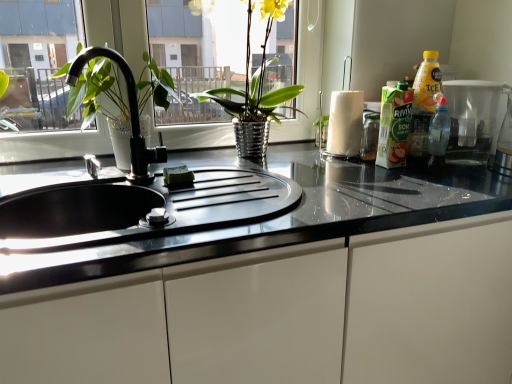
What do you see at coordinates (345, 123) in the screenshot?
I see `white glossy paper towel at center right` at bounding box center [345, 123].

Locate an element on the screen. This screenshot has width=512, height=384. white glossy paper towel at center right is located at coordinates 345,123.

Looking at this image, measure the distance between point (486, 141) and camera.

1.40 meters.

In order to face translucent plastic container at right, should I rotate leftwards or rightwards?

A 25.445 degree turn to the right will do.

Describe the element at coordinates (438, 136) in the screenshot. I see `transparent plastic bottle at right` at that location.

What do you see at coordinates (117, 95) in the screenshot? This screenshot has width=512, height=384. I see `black matte faucet at center` at bounding box center [117, 95].

What do you see at coordinates (255, 90) in the screenshot? I see `shiny metallic vase at center` at bounding box center [255, 90].

Find the location of a particular element. This screenshot has height=384, width=512. white glossy paper towel at center right is located at coordinates (345, 123).

From the image's perspective, is glossy white cabinet at center under black matte faucet at center?

Indeed, from the image's perspective, glossy white cabinet at center is shown beneath black matte faucet at center.

Is glossy white cabinet at center completely or partially outside of black matte faucet at center?

Yes.

How distant is glossy white cabinet at center from black matte faucet at center?

The distance of glossy white cabinet at center from black matte faucet at center is 64.97 centimeters.

Can you confirm if glossy white cabinet at center is positioned to the left of black matte faucet at center?

Incorrect, glossy white cabinet at center is not on the left side of black matte faucet at center.

Do you think transparent plastic bottle at right is within glossy white cabinet at center, or outside of it?

transparent plastic bottle at right is outside glossy white cabinet at center.

Between transparent plastic bottle at right and glossy white cabinet at center, which one has smaller size?

transparent plastic bottle at right.

Is transparent plastic bottle at right to the left of glossy white cabinet at center from the viewer's perspective?

In fact, transparent plastic bottle at right is to the right of glossy white cabinet at center.

Consider the image. Which is closer to the camera, [402,97] or [116,92]?

Point [402,97] appears to be closer to the viewer than point [116,92].

Is translucent plastic bottle at right smaller than black matte faucet at center?

Correct, translucent plastic bottle at right occupies less space than black matte faucet at center.

Is translucent plastic bottle at right completely or partially outside of black matte faucet at center?

Absolutely, translucent plastic bottle at right is external to black matte faucet at center.

In the scene shown: From the image's perspective, which object appears higher, translucent plastic bottle at right or black matte faucet at center?

black matte faucet at center, from the image's perspective.

Is translucent plastic bottle at right directly adjacent to shiny metallic vase at center?

translucent plastic bottle at right and shiny metallic vase at center are clearly separated.

Is translucent plastic bottle at right turned away from shiny metallic vase at center?

No.

Is translucent plastic bottle at right smaller than shiny metallic vase at center?

Correct, translucent plastic bottle at right occupies less space than shiny metallic vase at center.

Which is closer to the camera, (399, 90) or (245, 86)?

The point (399, 90) is closer to the camera.

Is point (393, 123) farther from camera compared to point (141, 317)?

Yes, point (393, 123) is behind point (141, 317).

Would you consider translucent plastic bottle at right to be distant from glossy white cabinet at center?

Actually, translucent plastic bottle at right and glossy white cabinet at center are a little close together.

Can you confirm if translucent plastic bottle at right is positioned to the right of glossy white cabinet at center?

Yes, translucent plastic bottle at right is to the right of glossy white cabinet at center.

In the scene shown: Which object is wider, translucent plastic bottle at right or glossy white cabinet at center?

glossy white cabinet at center.

Considering the relative sizes of shiny metallic vase at center and translucent plastic bottle at right in the image provided, is shiny metallic vase at center shorter than translucent plastic bottle at right?

No.

Considering the relative positions of shiny metallic vase at center and translucent plastic bottle at right in the image provided, is shiny metallic vase at center to the left or to the right of translucent plastic bottle at right?

shiny metallic vase at center is to the left of translucent plastic bottle at right.

Does shiny metallic vase at center lie in front of translucent plastic bottle at right?

That is True.

Choose the correct answer: Is shiny metallic vase at center inside translucent plastic bottle at right or outside it?

shiny metallic vase at center lies outside translucent plastic bottle at right.

From the image's perspective, relative to black matte faucet at center, is shiny metallic vase at center above or below?

From the image's perspective, shiny metallic vase at center appears above black matte faucet at center.

Does shiny metallic vase at center lie in front of black matte faucet at center?

No, shiny metallic vase at center is further to the viewer.

Can you confirm if shiny metallic vase at center is shorter than black matte faucet at center?

Incorrect, the height of shiny metallic vase at center does not fall short of that of black matte faucet at center.

In terms of width, does shiny metallic vase at center look wider or thinner when compared to black matte faucet at center?

shiny metallic vase at center is wider than black matte faucet at center.

At what (x,y) coordinates should I click in order to perform the action: click on tap behind the glossy white cabinet at center. Please return your answer as a coordinate pair (x, y). Looking at the image, I should click on (117, 95).

Locate an element on the screen. This screenshot has height=384, width=512. cabinetry in front of the transparent plastic bottle at right is located at coordinates (284, 315).

Estimate the real-world distances between objects in this image. Which object is closer to shiny metallic vase at center, glossy white cabinet at center or transparent plastic bottle at right?

transparent plastic bottle at right.

When comparing their distances from translucent plastic bottle at right, does glossy white cabinet at center or translucent plastic container at right seem further?

Based on the image, glossy white cabinet at center appears to be further to translucent plastic bottle at right.

Looking at the image, which one is located closer to shiny metallic vase at center, translucent plastic container at right or transparent plastic bottle at right?

Among the two, transparent plastic bottle at right is located nearer to shiny metallic vase at center.

In the scene shown: Based on their spatial positions, is glossy white cabinet at center or translucent plastic bottle at right further from white glossy paper towel at center right?

The object further to white glossy paper towel at center right is glossy white cabinet at center.

Based on their spatial positions, is black matte faucet at center or shiny metallic vase at center further from translucent plastic bottle at right?

black matte faucet at center is further to translucent plastic bottle at right.

From the image, which object appears to be farther from white glossy paper towel at center right, shiny metallic vase at center or glossy white cabinet at center?

glossy white cabinet at center.

Estimate the real-world distances between objects in this image. Which object is further from glossy white cabinet at center, translucent plastic container at right or shiny metallic vase at center?

shiny metallic vase at center.

From the image, which object appears to be farther from glossy white cabinet at center, white glossy paper towel at center right or translucent plastic bottle at right?

white glossy paper towel at center right.

Where is `paper towel located between shiny metallic vase at center and translucent plastic container at right in the left-right direction`? The image size is (512, 384). paper towel located between shiny metallic vase at center and translucent plastic container at right in the left-right direction is located at coordinates (345, 123).

Identify the location of cleaning product between black matte faucet at center and translucent plastic container at right from left to right. (394, 125).

Where is `tap that lies between white glossy paper towel at center right and glossy white cabinet at center from top to bottom`? The width and height of the screenshot is (512, 384). tap that lies between white glossy paper towel at center right and glossy white cabinet at center from top to bottom is located at coordinates (117, 95).

I want to click on cleaning product that lies between shiny metallic vase at center and glossy white cabinet at center from top to bottom, so click(x=394, y=125).